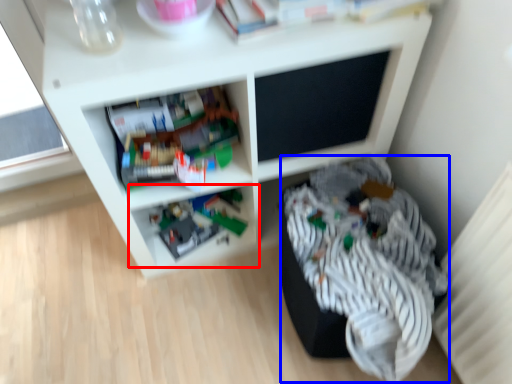
Question: Which object appears closest to the camera in this image, shelf (highlighted by a red box) or clothing (highlighted by a blue box)?

Choices:
 (A) shelf
 (B) clothing

Answer: (B)